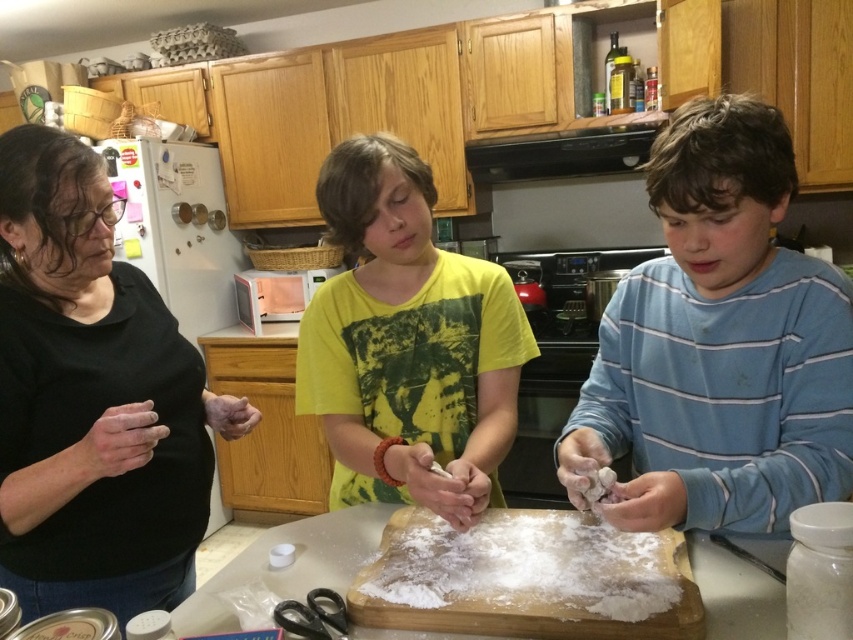
Can you confirm if blue striped sweater at center is taller than yellow cotton shirt at center?

Incorrect, blue striped sweater at center's height is not larger of yellow cotton shirt at center's.

Does blue striped sweater at center have a larger size compared to yellow cotton shirt at center?

Incorrect, blue striped sweater at center is not larger than yellow cotton shirt at center.

Locate an element on the screen. blue striped sweater at center is located at coordinates (718, 344).

From the picture: Who is more distant from viewer, (426, 241) or (546, 531)?

The point (426, 241) is more distant.

How much distance is there between yellow cotton shirt at center and white powdery flour at center?

They are 8.81 inches apart.

Who is more forward, (x=334, y=195) or (x=602, y=566)?

Point (x=602, y=566) is in front.

Find the location of a particular element. This screenshot has width=853, height=640. yellow cotton shirt at center is located at coordinates (407, 342).

Does point (622, 436) come closer to viewer compared to point (22, 560)?

No, (622, 436) is behind (22, 560).

Can you confirm if blue striped sweater at center is wider than black matte shirt at left?

Yes, blue striped sweater at center is wider than black matte shirt at left.

What are the coordinates of `blue striped sweater at center` in the screenshot? It's located at (718, 344).

Where is `blue striped sweater at center`? The image size is (853, 640). blue striped sweater at center is located at coordinates (718, 344).